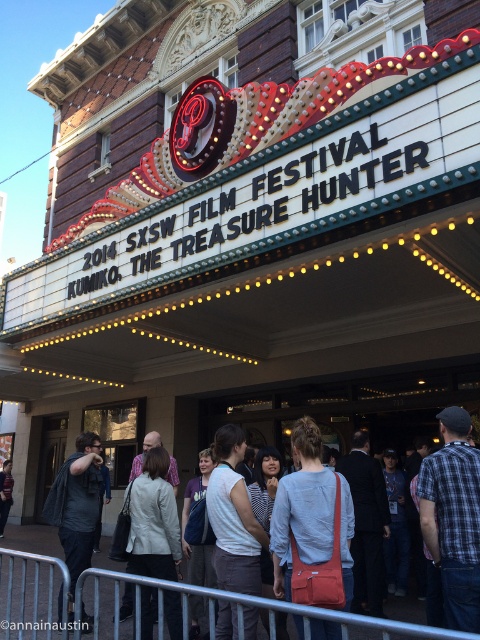
You are an event photographer at the 2014 SXSW Film Festival. You need to capture a photo of the theater entrance where the light gray cotton shirt at center and dark gray fabric jacket at center are visible. Which of the two garments should you focus on to ensure it takes up less space in the frame?

The light gray cotton shirt at center is smaller than the dark gray fabric jacket at center, so focusing on the light gray cotton shirt at center will ensure it takes up less space in the frame.

You are a photographer at the theater entrance. You need to capture a photo of both the light gray cotton shirt at center and the striped shirt at center. Since you want both shirts to appear clearly in the photo, which shirt should you focus on to ensure proper focus?

You should focus on the light gray cotton shirt at center because it is larger in size compared to the striped shirt at center, making it easier to capture clear details.